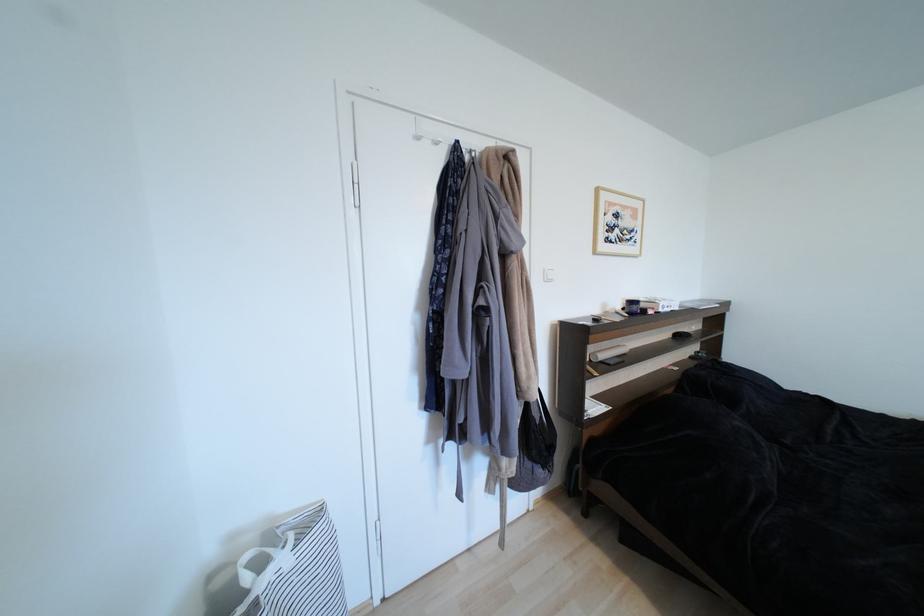
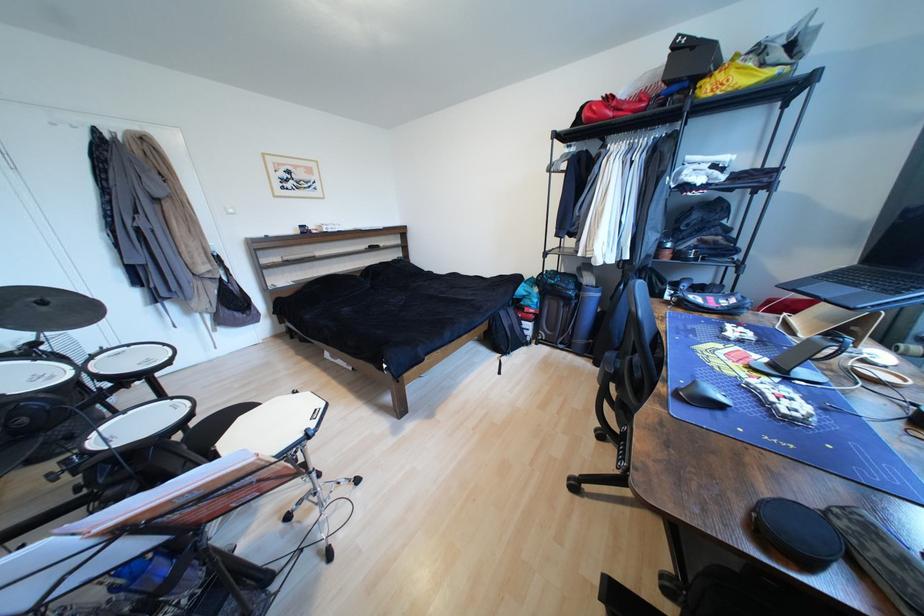
The point at (x=638, y=304) is marked in the first image. Where is the corresponding point in the second image?

(310, 228)